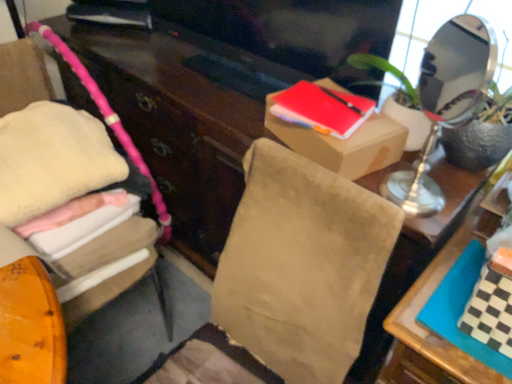
Question: Is matte red notebook at upper center, the second book in the bottom-to-top sequence, smaller than soft pink fabric at left?

Choices:
 (A) yes
 (B) no

Answer: (A)

Question: Would you consider matte red notebook at upper center, the second book from the right, to be distant from soft pink fabric at left?

Choices:
 (A) yes
 (B) no

Answer: (B)

Question: Is matte red notebook at upper center, acting as the first book starting from the back, beside soft pink fabric at left?

Choices:
 (A) no
 (B) yes

Answer: (A)

Question: Can you confirm if matte red notebook at upper center, placed as the second book when sorted from front to back, is wider than soft pink fabric at left?

Choices:
 (A) yes
 (B) no

Answer: (B)

Question: Is matte red notebook at upper center, the second book from the right, thinner than soft pink fabric at left?

Choices:
 (A) yes
 (B) no

Answer: (A)

Question: Can you confirm if matte red notebook at upper center, which is counted as the 1th book, starting from the left, is bigger than soft pink fabric at left?

Choices:
 (A) no
 (B) yes

Answer: (A)

Question: Is green textured plant at upper right at the left side of matte red notebook at upper center, which is counted as the first book, starting from the top?

Choices:
 (A) no
 (B) yes

Answer: (A)

Question: Can you see green textured plant at upper right touching matte red notebook at upper center, the second book in the bottom-to-top sequence?

Choices:
 (A) yes
 (B) no

Answer: (B)

Question: Does green textured plant at upper right have a lesser width compared to matte red notebook at upper center, placed as the second book when sorted from front to back?

Choices:
 (A) no
 (B) yes

Answer: (B)

Question: From the image's perspective, would you say green textured plant at upper right is shown under matte red notebook at upper center, which is counted as the 1th book, starting from the left?

Choices:
 (A) no
 (B) yes

Answer: (B)

Question: Is green textured plant at upper right aimed at matte red notebook at upper center, the second book in the bottom-to-top sequence?

Choices:
 (A) no
 (B) yes

Answer: (A)

Question: Is green textured plant at upper right outside matte red notebook at upper center, the second book from the right?

Choices:
 (A) no
 (B) yes

Answer: (B)

Question: From a real-world perspective, is green textured plant at upper right physically below soft pink fabric at left?

Choices:
 (A) no
 (B) yes

Answer: (A)